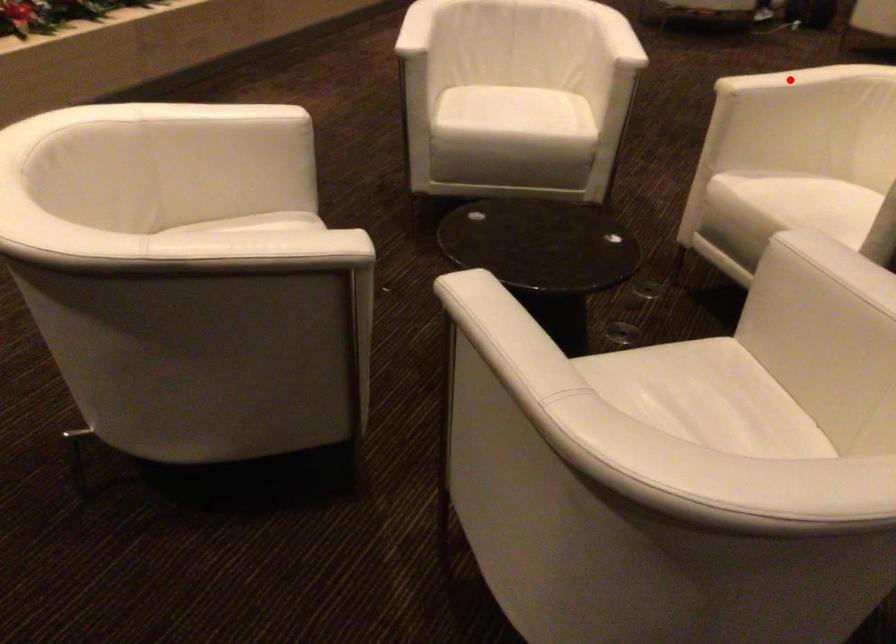
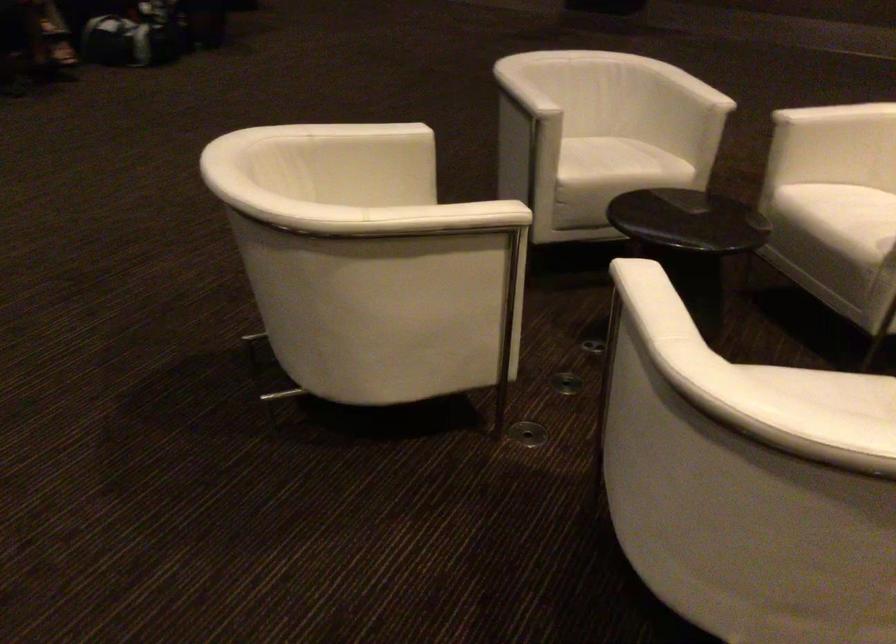
Question: I am providing you with two images of the same scene from different viewpoints. A red point is marked on the first image. At the location where the point appears in image 1, is it still visible in image 2?

Choices:
 (A) Yes
 (B) No

Answer: (B)